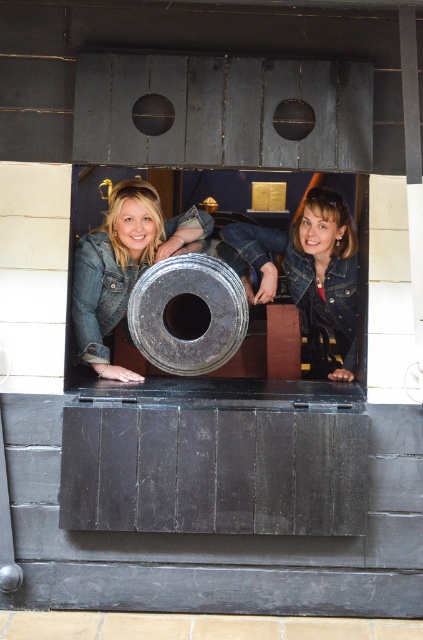
Does denim jacket at center appear on the left side of brushed metal denim jacket at lower center?

In fact, denim jacket at center is to the right of brushed metal denim jacket at lower center.

From the picture: Can you confirm if denim jacket at center is bigger than brushed metal denim jacket at lower center?

Indeed, denim jacket at center has a larger size compared to brushed metal denim jacket at lower center.

Is point (316, 300) more distant than point (91, 248)?

Yes, point (316, 300) is farther from viewer.

Find the location of `denim jacket at center`. denim jacket at center is located at coordinates (310, 268).